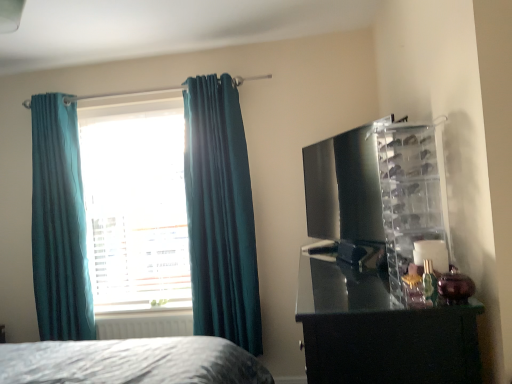
Image resolution: width=512 pixels, height=384 pixels. Identify the location of white matte radiator at lower left. (144, 324).

Describe the element at coordinates (144, 324) in the screenshot. I see `white matte radiator at lower left` at that location.

Find the location of a particular element. This screenshot has height=384, width=512. glossy black dresser at right is located at coordinates (379, 263).

Which of these two, teal velvet curtains at left, the 2th curtain from the left, or teal fabric window at center, is bigger?

teal velvet curtains at left, the 2th curtain from the left, is bigger.

Does point (242, 168) appear closer or farther from the camera than point (105, 107)?

Point (242, 168) appears to be closer to the viewer than point (105, 107).

Is teal velvet curtains at left, which is the 1th curtain from right to left, shorter than teal fabric window at center?

No, teal velvet curtains at left, which is the 1th curtain from right to left, is not shorter than teal fabric window at center.

Looking at this image, is teal velvet curtains at left, the 2th curtain from the left, to the left of teal fabric window at center from the viewer's perspective?

Incorrect, teal velvet curtains at left, the 2th curtain from the left, is not on the left side of teal fabric window at center.

Is clear plastic shoe rack at right beside teal velvet curtains at left, the 2th curtain from the left?

No, clear plastic shoe rack at right is not making contact with teal velvet curtains at left, the 2th curtain from the left.

Considering the relative positions of clear plastic shoe rack at right and teal velvet curtains at left, which is the 1th curtain from right to left, in the image provided, is clear plastic shoe rack at right to the left of teal velvet curtains at left, which is the 1th curtain from right to left, from the viewer's perspective?

No, clear plastic shoe rack at right is not to the left of teal velvet curtains at left, which is the 1th curtain from right to left.

Is clear plastic shoe rack at right wider than teal velvet curtains at left, which is the 1th curtain from right to left?

Indeed, clear plastic shoe rack at right has a greater width compared to teal velvet curtains at left, which is the 1th curtain from right to left.

From a real-world perspective, between clear plastic shoe rack at right and teal velvet curtains at left, which is the 1th curtain from right to left, who is vertically lower?

From a 3D spatial view, teal velvet curtains at left, which is the 1th curtain from right to left, is below.

Is clear plastic shoe rack at right with teal fabric curtain at left, the first curtain from the left?

No, clear plastic shoe rack at right is not in contact with teal fabric curtain at left, the first curtain from the left.

Considering the sizes of clear plastic shoe rack at right and teal fabric curtain at left, positioned as the 2th curtain in right-to-left order, in the image, is clear plastic shoe rack at right taller or shorter than teal fabric curtain at left, positioned as the 2th curtain in right-to-left order,?

In the image, clear plastic shoe rack at right appears to be shorter than teal fabric curtain at left, positioned as the 2th curtain in right-to-left order.

Considering the points (410, 145) and (61, 320), which point is behind, point (410, 145) or point (61, 320)?

Point (61, 320)

Considering the sizes of objects glossy black dresser at right and white matte radiator at lower left in the image provided, who is bigger, glossy black dresser at right or white matte radiator at lower left?

glossy black dresser at right is bigger.

Does glossy black dresser at right appear on the left side of white matte radiator at lower left?

Incorrect, glossy black dresser at right is not on the left side of white matte radiator at lower left.

Considering the sizes of glossy black dresser at right and white matte radiator at lower left in the image, is glossy black dresser at right wider or thinner than white matte radiator at lower left?

glossy black dresser at right is wider than white matte radiator at lower left.

Is white matte radiator at lower left completely or partially inside glossy black dresser at right?

No.

Is teal fabric curtain at left, the first curtain from the left, wider than teal fabric window at center?

Correct, the width of teal fabric curtain at left, the first curtain from the left, exceeds that of teal fabric window at center.

From the image's perspective, relative to teal fabric window at center, is teal fabric curtain at left, positioned as the 2th curtain in right-to-left order, above or below?

teal fabric curtain at left, positioned as the 2th curtain in right-to-left order, is situated lower than teal fabric window at center in the image.

In the scene shown: Between teal fabric curtain at left, positioned as the 2th curtain in right-to-left order, and teal fabric window at center, which one has less height?

teal fabric window at center.

Which object is thinner, clear plastic shoe rack at right or teal fabric window at center?

With smaller width is teal fabric window at center.

From the image's perspective, is clear plastic shoe rack at right beneath teal fabric window at center?

Actually, clear plastic shoe rack at right appears above teal fabric window at center in the image.

Which is in front, clear plastic shoe rack at right or teal fabric window at center?

clear plastic shoe rack at right is more forward.

Is point (99, 317) farther from camera compared to point (381, 215)?

Yes, it is.

Can you confirm if white matte radiator at lower left is thinner than glossy black dresser at right?

Correct, the width of white matte radiator at lower left is less than that of glossy black dresser at right.

Identify the location of entertainment center in front of the white matte radiator at lower left. (379, 263).

Is white matte radiator at lower left oriented towards glossy black dresser at right?

No, white matte radiator at lower left is not facing towards glossy black dresser at right.

From a real-world perspective, starting from the teal fabric window at center, which curtain is the 2nd one below it? Please provide its 2D coordinates.

[(220, 215)]

You are a GUI agent. You are given a task and a screenshot of the screen. Output one action in this format:
    pyautogui.click(x=<x>, y=<y>)
    Task: Click on the cabinet to the right of teal velvet curtains at left, which is the 1th curtain from right to left
    The image size is (512, 384).
    Given the screenshot: What is the action you would take?
    pyautogui.click(x=409, y=194)

Considering their positions, is white matte radiator at lower left positioned further to teal fabric curtain at left, positioned as the 2th curtain in right-to-left order, than clear plastic shoe rack at right?

clear plastic shoe rack at right lies further to teal fabric curtain at left, positioned as the 2th curtain in right-to-left order, than the other object.

From the image, which object appears to be farther from teal fabric curtain at left, positioned as the 2th curtain in right-to-left order, glossy black dresser at right or clear plastic shoe rack at right?

Based on the image, clear plastic shoe rack at right appears to be further to teal fabric curtain at left, positioned as the 2th curtain in right-to-left order.

Consider the image. Which object lies nearer to the anchor point white matte radiator at lower left, glossy black dresser at right or teal velvet curtains at left, which is the 1th curtain from right to left?

teal velvet curtains at left, which is the 1th curtain from right to left, lies closer to white matte radiator at lower left than the other object.

Considering their positions, is teal fabric window at center positioned closer to clear plastic shoe rack at right than teal velvet curtains at left, which is the 1th curtain from right to left?

teal velvet curtains at left, which is the 1th curtain from right to left, is closer to clear plastic shoe rack at right.

When comparing their distances from teal fabric curtain at left, the first curtain from the left, does glossy black dresser at right or teal velvet curtains at left, which is the 1th curtain from right to left, seem further?

glossy black dresser at right.

Considering their positions, is teal fabric curtain at left, positioned as the 2th curtain in right-to-left order, positioned further to clear plastic shoe rack at right than glossy black dresser at right?

Based on the image, teal fabric curtain at left, positioned as the 2th curtain in right-to-left order, appears to be further to clear plastic shoe rack at right.

When comparing their distances from glossy black dresser at right, does teal fabric window at center or teal velvet curtains at left, the 2th curtain from the left, seem closer?

Among the two, teal velvet curtains at left, the 2th curtain from the left, is located nearer to glossy black dresser at right.

Considering their positions, is white matte radiator at lower left positioned closer to teal velvet curtains at left, the 2th curtain from the left, than clear plastic shoe rack at right?

Based on the image, white matte radiator at lower left appears to be nearer to teal velvet curtains at left, the 2th curtain from the left.

Locate an element on the screen. curtain between teal fabric curtain at left, the first curtain from the left, and glossy black dresser at right, in the horizontal direction is located at coordinates (220, 215).

Where is `radiator between teal fabric curtain at left, the first curtain from the left, and teal velvet curtains at left, which is the 1th curtain from right to left`? radiator between teal fabric curtain at left, the first curtain from the left, and teal velvet curtains at left, which is the 1th curtain from right to left is located at coordinates (144, 324).

The width and height of the screenshot is (512, 384). I want to click on curtain situated between teal fabric curtain at left, the first curtain from the left, and clear plastic shoe rack at right from left to right, so click(220, 215).

At what (x,y) coordinates should I click in order to perform the action: click on cabinet between glossy black dresser at right and teal fabric window at center from front to back. Please return your answer as a coordinate pair (x, y). This screenshot has height=384, width=512. Looking at the image, I should click on (409, 194).